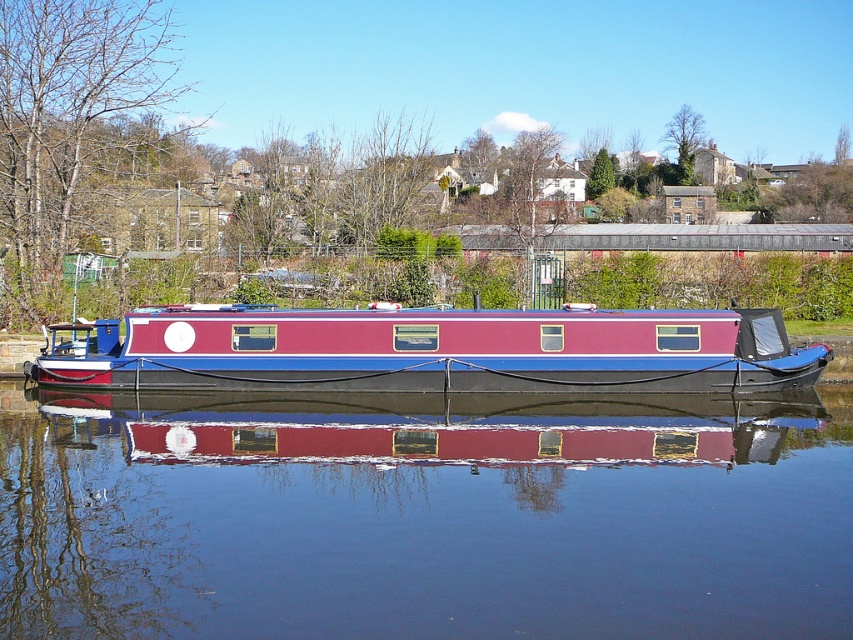
You are a photographer standing on the riverside bank. You want to capture the reflection of the matte red and blue boat at center in the glossy blue water at center. Is the boat positioned in a way that its reflection would be clearly visible in the water?

The glossy blue water at center is positioned under the matte red and blue boat at center, so the boat is directly above the water. This positioning would allow its reflection to be clearly visible in the glossy blue water at center due to the water being still and reflective as described in the scene.

You are standing at the camera position and want to reach point (x=398, y=445). Is the distance more than 10 meters?

The distance between point (x=398, y=445) and the camera is 13.53 meters, so yes, it is more than 10 meters.